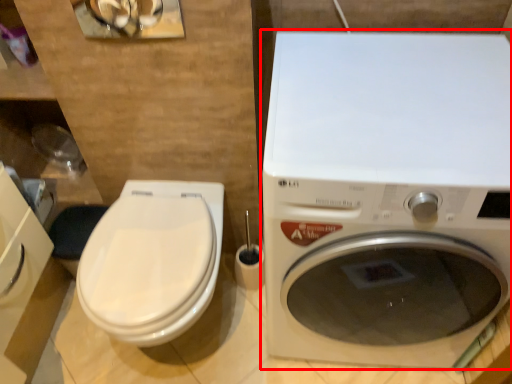
Question: Where is washing machine (annotated by the red box) located in relation to toilet in the image?

Choices:
 (A) right
 (B) left

Answer: (A)